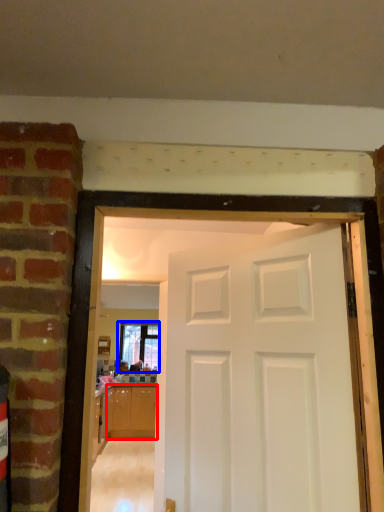
Question: Which object appears closest to the camera in this image, cabinetry (highlighted by a red box) or window (highlighted by a blue box)?

Choices:
 (A) cabinetry
 (B) window

Answer: (A)